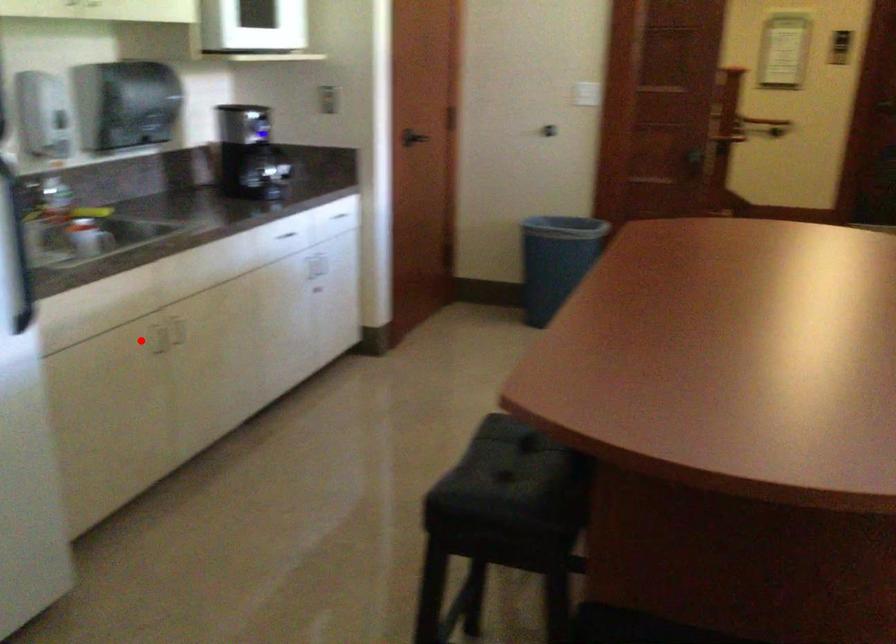
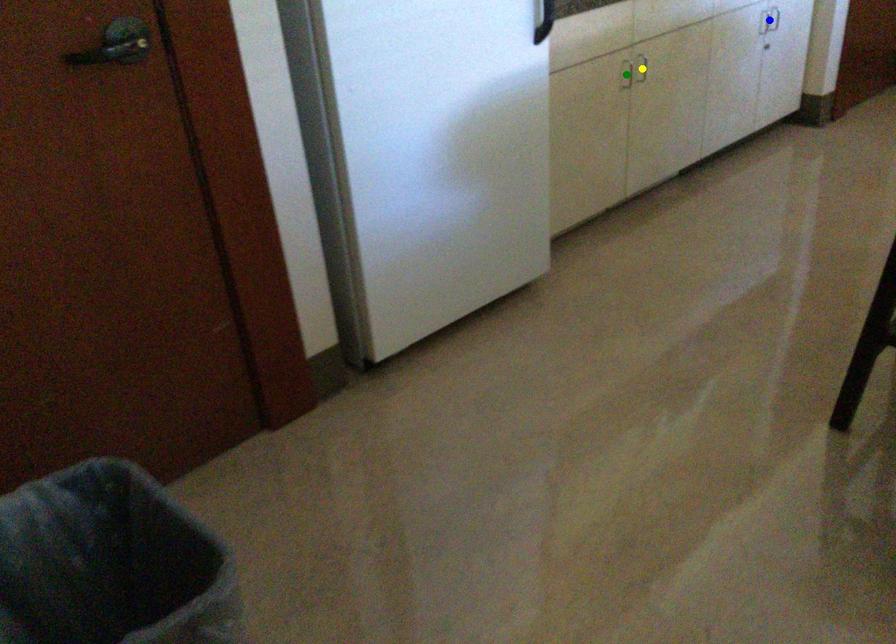
Question: I am providing you with two images of the same scene from different viewpoints. A red point is marked on the first image. You are given multiple points on the second image. In image 2, which mark is for the same physical point as the one in image 1?

Choices:
 (A) yellow point
 (B) green point
 (C) blue point

Answer: (B)